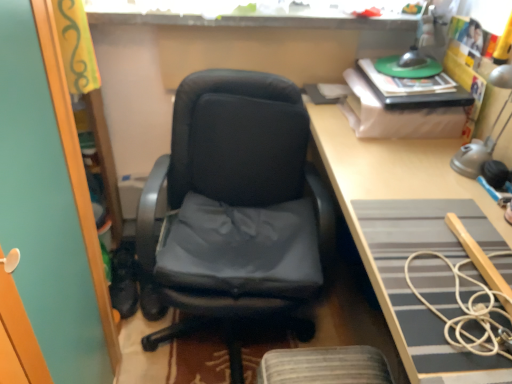
Question: Is metallic silver table lamp at upper right wider or thinner than white cord at right?

Choices:
 (A) wide
 (B) thin

Answer: (B)

Question: Is point (473, 177) positioned closer to the camera than point (457, 283)?

Choices:
 (A) farther
 (B) closer

Answer: (A)

Question: Which of these objects is positioned farthest from the metallic silver table lamp at upper right?

Choices:
 (A) matte black office chair at center
 (B) white cord at right
 (C) light brown wooden desk at center

Answer: (A)

Question: Estimate the real-world distances between objects in this image. Which object is closer to the metallic silver table lamp at upper right?

Choices:
 (A) white cord at right
 (B) light brown wooden desk at center
 (C) matte black office chair at center

Answer: (B)